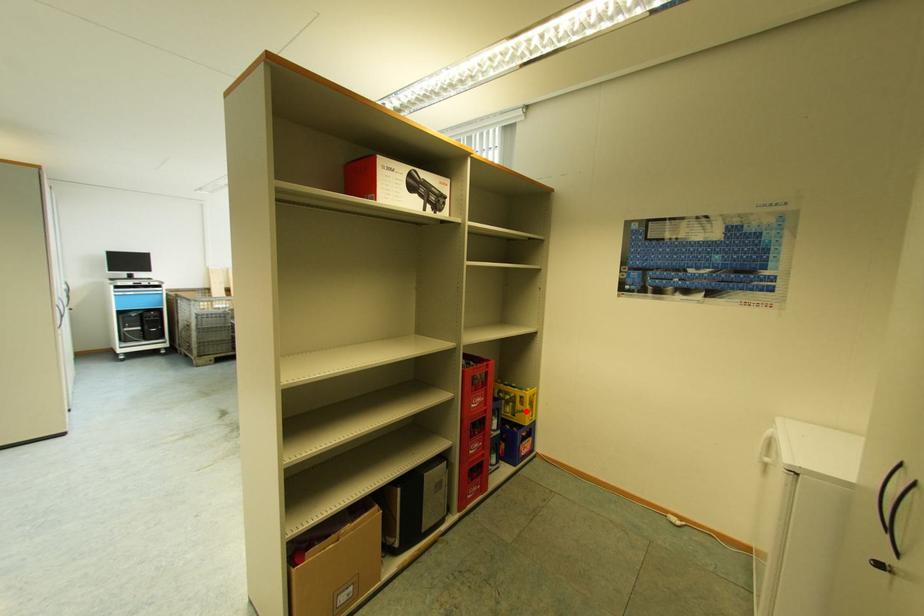
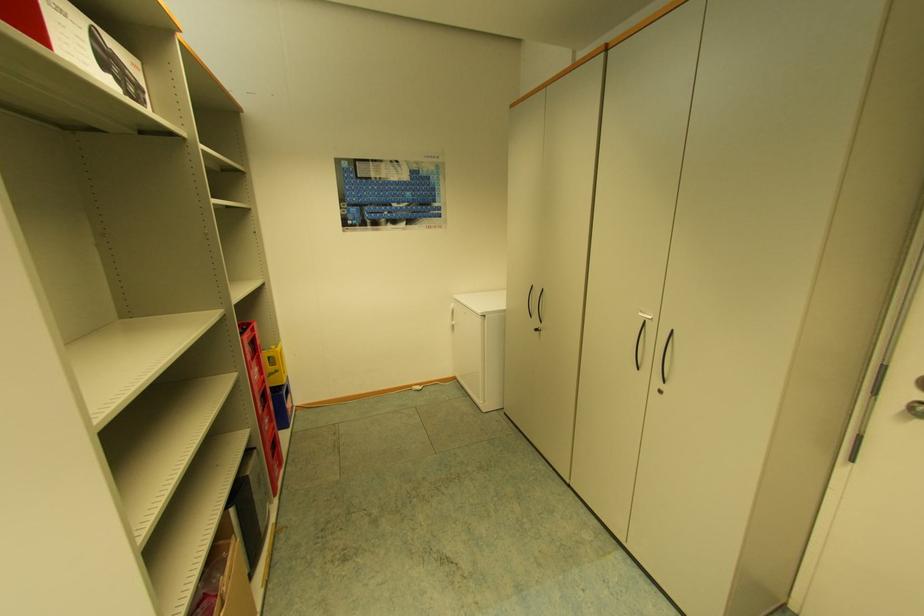
In the second image, find the point that corresponds to the highlighted location in the first image.

(281, 371)